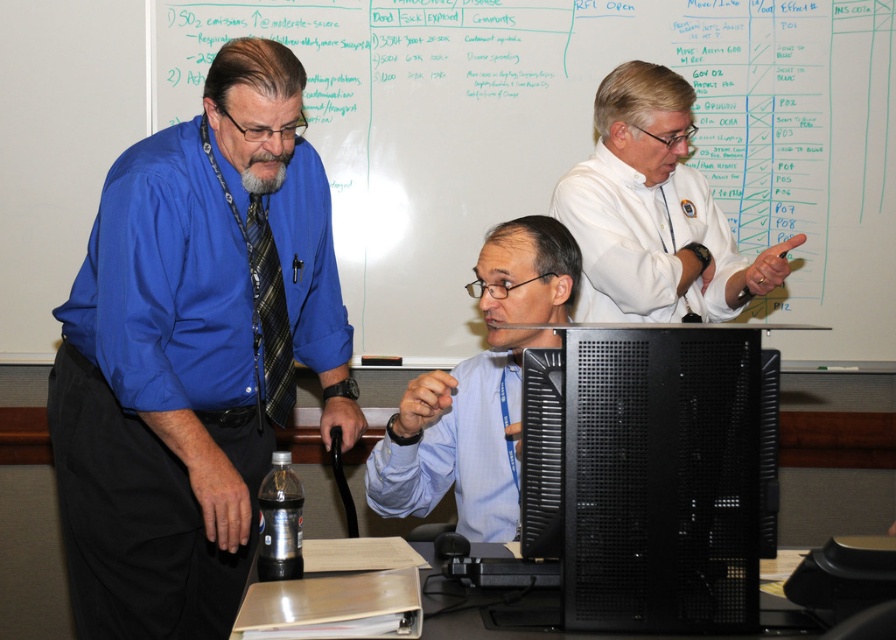
You are a photographer standing in the room and want to take a photo that includes both the light blue shirt at center and the plaid fabric tie at left. The camera has a maximum focus range of 15 inches. Can you capture both subjects in focus without moving the camera or subjects?

The light blue shirt at center and the plaid fabric tie at left are 15.69 inches apart, which exceeds the camera maximum focus range of 15 inches. Therefore, you cannot capture both subjects in focus without adjusting the camera or moving the subjects.

Based on the scene described, which object is positioned to the right of the other? The light blue shirt at center or the plaid fabric tie at left?

The light blue shirt at center is to the right of the plaid fabric tie at left.